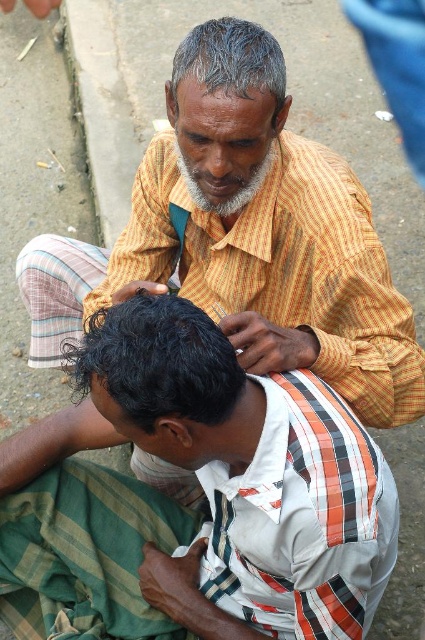
Question: Is white striped shirt at lower center closer to the viewer compared to dark brown hair at lower left?

Choices:
 (A) yes
 (B) no

Answer: (B)

Question: Among these objects, which one is farthest from the camera?

Choices:
 (A) white striped shirt at lower center
 (B) dark brown hair at lower left
 (C) green striped cloth at lower left
 (D) gray hair at upper center

Answer: (C)

Question: Is white striped shirt at lower center positioned behind gray hair at upper center?

Choices:
 (A) yes
 (B) no

Answer: (B)

Question: Which point appears closest to the camera in this image?

Choices:
 (A) (178, 314)
 (B) (221, 61)
 (C) (170, 531)

Answer: (A)

Question: Among these objects, which one is farthest from the camera?

Choices:
 (A) gray hair at upper center
 (B) white striped shirt at lower center
 (C) dark brown hair at lower left
 (D) green striped cloth at lower left

Answer: (D)

Question: From the image, what is the correct spatial relationship of white striped shirt at lower center in relation to dark brown hair at lower left?

Choices:
 (A) below
 (B) above

Answer: (A)